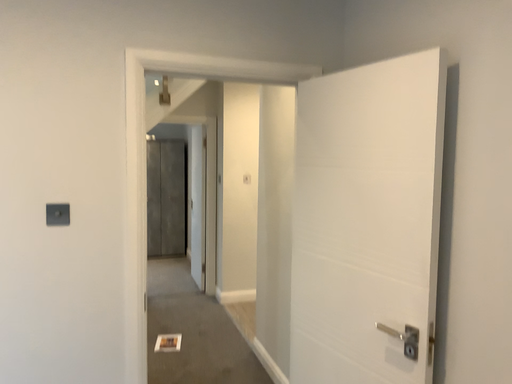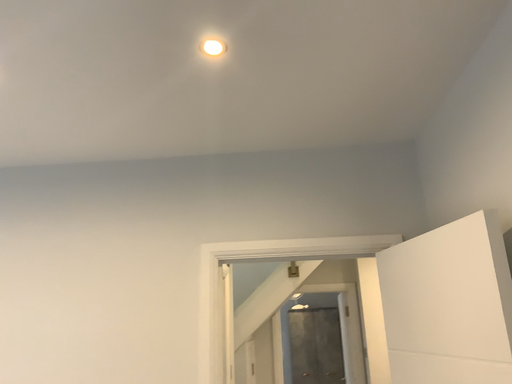
Question: How did the camera likely rotate when shooting the video?

Choices:
 (A) rotated downward
 (B) rotated upward

Answer: (B)